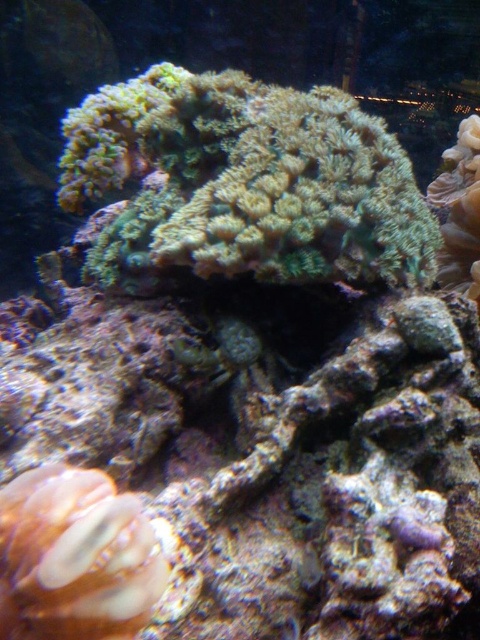
Between green textured coral at center and translucent orange coral at lower left, which one is positioned lower?

translucent orange coral at lower left is below.

Which is more to the left, green textured coral at center or translucent orange coral at lower left?

translucent orange coral at lower left

Who is more distant from viewer, (271, 234) or (144, 624)?

The point (271, 234) is behind.

Find the location of a particular element. This screenshot has width=480, height=640. green textured coral at center is located at coordinates (244, 182).